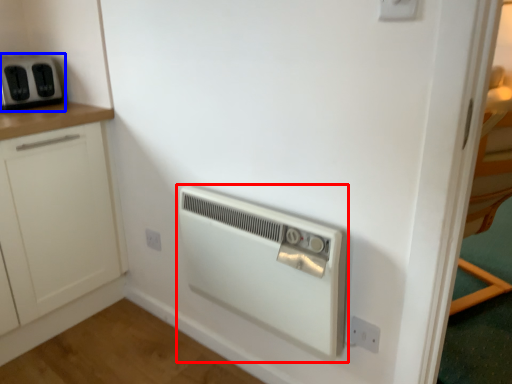
Question: Which object is closer to the camera taking this photo, home appliance (highlighted by a red box) or home appliance (highlighted by a blue box)?

Choices:
 (A) home appliance
 (B) home appliance

Answer: (A)